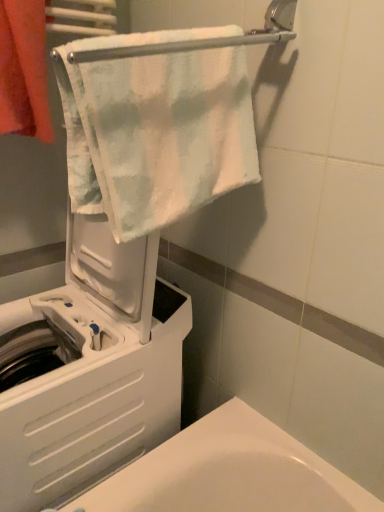
Question: Is white soft towel at upper center, placed as the second towel when sorted from left to right, shorter than white plastic washing machine at left?

Choices:
 (A) yes
 (B) no

Answer: (A)

Question: Considering the relative positions of white soft towel at upper center, which is the first towel from right to left, and white plastic washing machine at left in the image provided, is white soft towel at upper center, which is the first towel from right to left, behind white plastic washing machine at left?

Choices:
 (A) no
 (B) yes

Answer: (A)

Question: From the image's perspective, is white soft towel at upper center, which is the first towel from right to left, below white plastic washing machine at left?

Choices:
 (A) no
 (B) yes

Answer: (A)

Question: Can you confirm if white soft towel at upper center, placed as the second towel when sorted from left to right, is bigger than white plastic washing machine at left?

Choices:
 (A) yes
 (B) no

Answer: (B)

Question: Considering the relative positions of white soft towel at upper center, placed as the second towel when sorted from left to right, and white plastic washing machine at left in the image provided, is white soft towel at upper center, placed as the second towel when sorted from left to right, to the left of white plastic washing machine at left from the viewer's perspective?

Choices:
 (A) yes
 (B) no

Answer: (B)

Question: Considering their positions, is orange cotton towel at upper left, marked as the second towel in a right-to-left arrangement, located in front of or behind white plastic washing machine at left?

Choices:
 (A) front
 (B) behind

Answer: (B)

Question: Is point (41, 111) closer or farther from the camera than point (109, 412)?

Choices:
 (A) farther
 (B) closer

Answer: (B)

Question: Is orange cotton towel at upper left, marked as the second towel in a right-to-left arrangement, inside the boundaries of white plastic washing machine at left, or outside?

Choices:
 (A) outside
 (B) inside

Answer: (A)

Question: Is orange cotton towel at upper left, marked as the second towel in a right-to-left arrangement, wider or thinner than white plastic washing machine at left?

Choices:
 (A) thin
 (B) wide

Answer: (A)

Question: From the image's perspective, is white plastic washing machine at left above or below white soft towel at upper center, placed as the second towel when sorted from left to right?

Choices:
 (A) above
 (B) below

Answer: (B)

Question: In the image, is white plastic washing machine at left positioned in front of or behind white soft towel at upper center, which is the first towel from right to left?

Choices:
 (A) behind
 (B) front

Answer: (A)

Question: From a real-world perspective, is white plastic washing machine at left physically located above or below white soft towel at upper center, placed as the second towel when sorted from left to right?

Choices:
 (A) below
 (B) above

Answer: (A)

Question: Is point (66, 311) closer or farther from the camera than point (66, 79)?

Choices:
 (A) farther
 (B) closer

Answer: (A)

Question: Looking at the image, does white plastic washing machine at left seem bigger or smaller compared to orange cotton towel at upper left, marked as the second towel in a right-to-left arrangement?

Choices:
 (A) big
 (B) small

Answer: (A)

Question: Relative to orange cotton towel at upper left, positioned as the 1th towel in left-to-right order, is white plastic washing machine at left in front or behind?

Choices:
 (A) front
 (B) behind

Answer: (A)